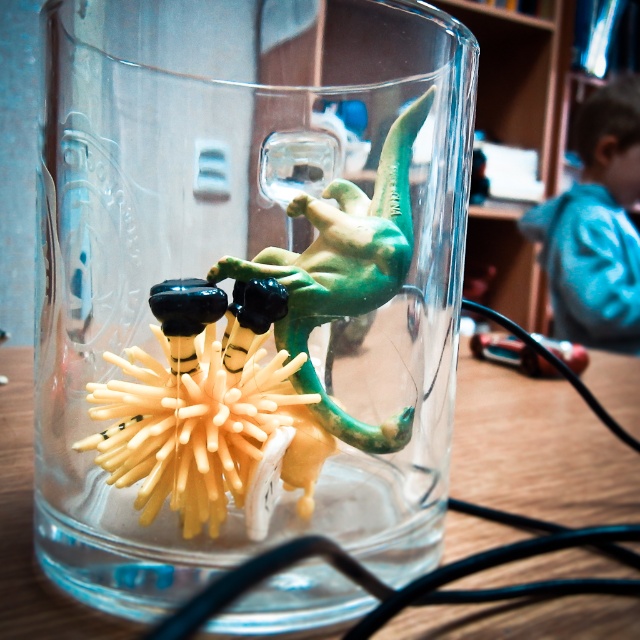
Question: Which object appears closest to the camera in this image?

Choices:
 (A) transparent glass jar at center
 (B) wooden table at center
 (C) blue denim shirt at upper right

Answer: (A)

Question: Does transparent glass jar at center have a smaller size compared to blue denim shirt at upper right?

Choices:
 (A) no
 (B) yes

Answer: (B)

Question: Is transparent glass jar at center positioned in front of blue denim shirt at upper right?

Choices:
 (A) yes
 (B) no

Answer: (A)

Question: Which of these objects is positioned farthest from the blue denim shirt at upper right?

Choices:
 (A) transparent glass jar at center
 (B) wooden table at center

Answer: (A)

Question: Which of the following is the closest to the observer?

Choices:
 (A) click(x=474, y=611)
 (B) click(x=40, y=394)

Answer: (A)

Question: Considering the relative positions of wooden table at center and blue denim shirt at upper right in the image provided, where is wooden table at center located with respect to blue denim shirt at upper right?

Choices:
 (A) right
 (B) left

Answer: (B)